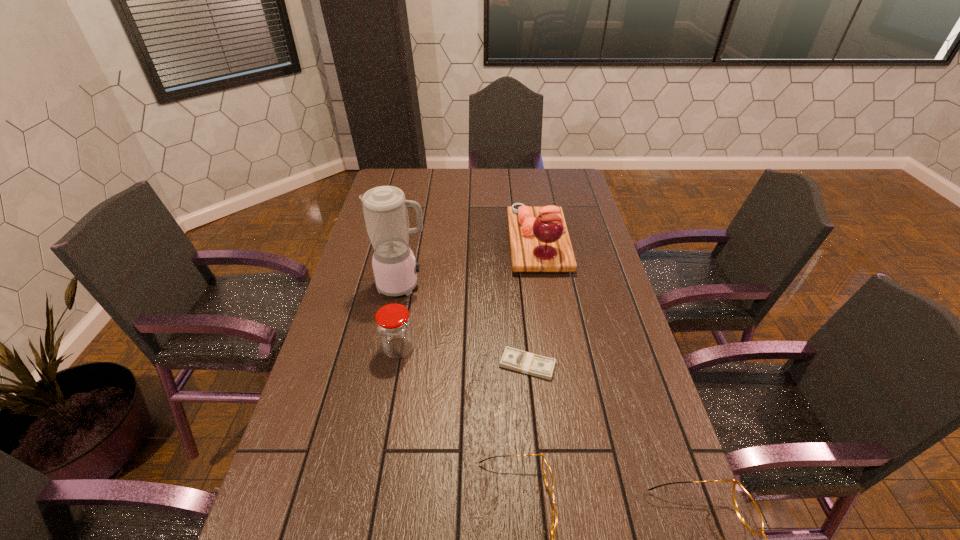
Locate an element on the screen. The width and height of the screenshot is (960, 540). vacant space that satisfies the following two spatial constraints: 1. on the front side of the platter; 2. on the base of the food processor near the control knob is located at coordinates (545, 285).

What are the coordinates of `free space that satisfies the following two spatial constraints: 1. on the base of the tallest object near the control knob; 2. on the left side of the dollar` in the screenshot? It's located at (387, 364).

Locate an element on the screen. This screenshot has height=540, width=960. vacant area that satisfies the following two spatial constraints: 1. on the base of the tallest object near the control knob; 2. on the right side of the dollar is located at coordinates (387, 364).